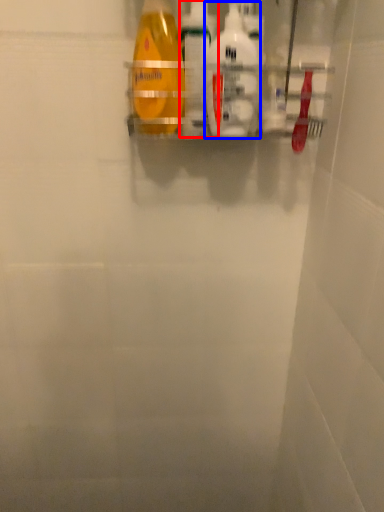
Question: Which object is further to the camera taking this photo, cleaning product (highlighted by a red box) or cleaning product (highlighted by a blue box)?

Choices:
 (A) cleaning product
 (B) cleaning product

Answer: (A)